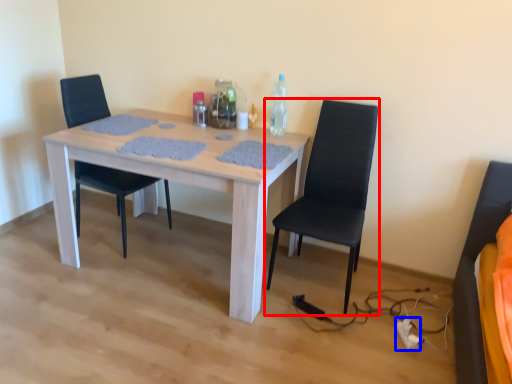
Question: Which object is closer to the camera taking this photo, chair (highlighted by a red box) or extension cord (highlighted by a blue box)?

Choices:
 (A) chair
 (B) extension cord

Answer: (A)